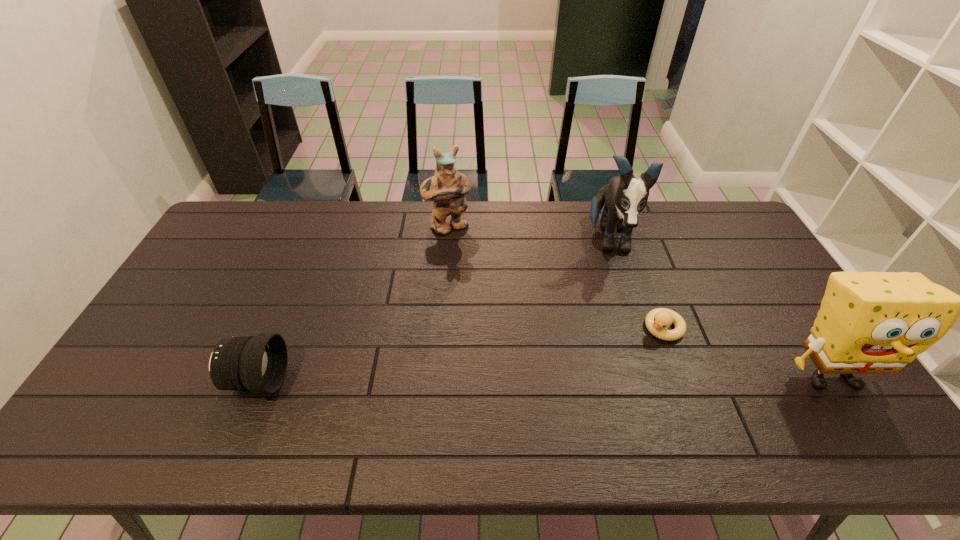
In order to click on the fourth tallest object in this screenshot , I will do `click(258, 364)`.

This screenshot has width=960, height=540. Find the location of `the leftmost object`. the leftmost object is located at coordinates (258, 364).

I want to click on the rightmost object, so click(x=869, y=322).

Where is `duckling`? The image size is (960, 540). duckling is located at coordinates (657, 320).

Where is `the third nearest object`? the third nearest object is located at coordinates (657, 320).

Locate an element on the screen. The image size is (960, 540). figurine is located at coordinates (447, 187).

This screenshot has width=960, height=540. I want to click on the tallest object, so click(x=624, y=197).

At what (x,y) coordinates should I click in order to perform the action: click on vacant space located 0.130m at the front element of the telephoto lens. Please return your answer as a coordinate pair (x, y). The image size is (960, 540). Looking at the image, I should click on (335, 380).

Identify the location of free point located at the beak of the shortest object. (583, 397).

You are a GUI agent. You are given a task and a screenshot of the screen. Output one action in this format:
    pyautogui.click(x=<x>, y=<y>)
    Task: Click on the vacant space located 0.310m at the beak of the shortest object
    The height and width of the screenshot is (540, 960).
    Given the screenshot: What is the action you would take?
    [x=578, y=402]